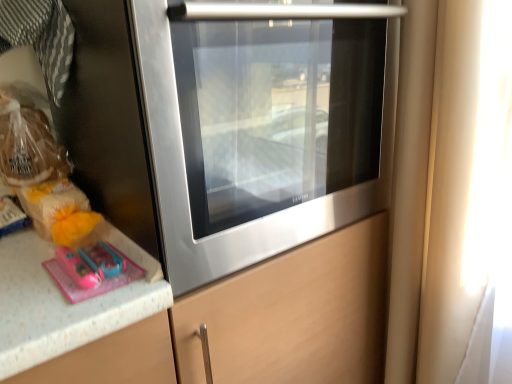
Question: Is translucent plastic bread at left, the second food in the bottom-to-top sequence, further to camera compared to transparent glass window at right?

Choices:
 (A) yes
 (B) no

Answer: (A)

Question: From the image's perspective, would you say translucent plastic bread at left, the second food in the bottom-to-top sequence, is shown under transparent glass window at right?

Choices:
 (A) yes
 (B) no

Answer: (B)

Question: Would you say translucent plastic bread at left, marked as the first food in a top-to-bottom arrangement, contains transparent glass window at right?

Choices:
 (A) no
 (B) yes

Answer: (A)

Question: Considering the relative sizes of translucent plastic bread at left, the second food in the bottom-to-top sequence, and transparent glass window at right in the image provided, is translucent plastic bread at left, the second food in the bottom-to-top sequence, thinner than transparent glass window at right?

Choices:
 (A) yes
 (B) no

Answer: (A)

Question: Does translucent plastic bread at left, marked as the first food in a top-to-bottom arrangement, lie in front of transparent glass window at right?

Choices:
 (A) yes
 (B) no

Answer: (B)

Question: Is translucent plastic bread at left, marked as the first food in a top-to-bottom arrangement, taller or shorter than stainless steel oven at center?

Choices:
 (A) short
 (B) tall

Answer: (A)

Question: Is translucent plastic bread at left, the second food in the bottom-to-top sequence, spatially inside stainless steel oven at center, or outside of it?

Choices:
 (A) inside
 (B) outside

Answer: (B)

Question: Based on their sizes in the image, would you say translucent plastic bread at left, marked as the first food in a top-to-bottom arrangement, is bigger or smaller than stainless steel oven at center?

Choices:
 (A) small
 (B) big

Answer: (A)

Question: Looking at their shapes, would you say translucent plastic bread at left, the second food in the bottom-to-top sequence, is wider or thinner than stainless steel oven at center?

Choices:
 (A) thin
 (B) wide

Answer: (A)

Question: Do you think translucent plastic bag at left, which ranks as the 2th food in top-to-bottom order, is within transparent glass window at right, or outside of it?

Choices:
 (A) inside
 (B) outside

Answer: (B)

Question: Does point (60, 216) appear closer or farther from the camera than point (442, 221)?

Choices:
 (A) farther
 (B) closer

Answer: (B)

Question: In the image, is translucent plastic bag at left, which ranks as the 1th food in bottom-to-top order, positioned in front of or behind transparent glass window at right?

Choices:
 (A) behind
 (B) front

Answer: (A)

Question: Is translucent plastic bag at left, which ranks as the 2th food in top-to-bottom order, taller or shorter than transparent glass window at right?

Choices:
 (A) short
 (B) tall

Answer: (A)

Question: Is point (492, 271) closer or farther from the camera than point (295, 99)?

Choices:
 (A) farther
 (B) closer

Answer: (A)

Question: Is transparent glass window at right to the left or to the right of stainless steel oven at center in the image?

Choices:
 (A) left
 (B) right

Answer: (B)